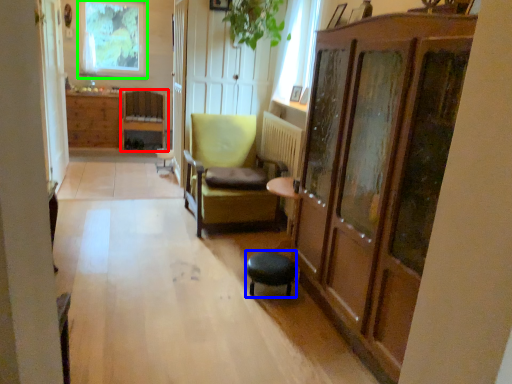
Question: Considering the real-world distances, which object is closest to chair (highlighted by a red box)? stool (highlighted by a blue box) or window (highlighted by a green box).

Choices:
 (A) stool
 (B) window

Answer: (B)